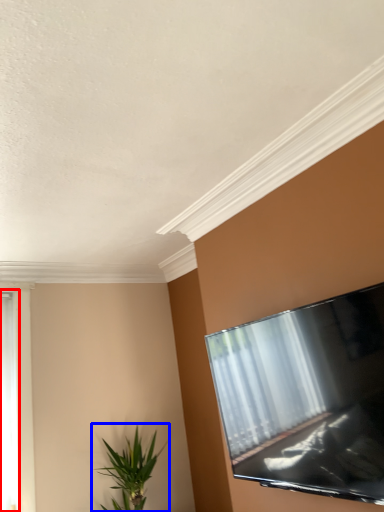
Question: Which point is further to the camera, window (highlighted by a red box) or houseplant (highlighted by a blue box)?

Choices:
 (A) window
 (B) houseplant

Answer: (A)